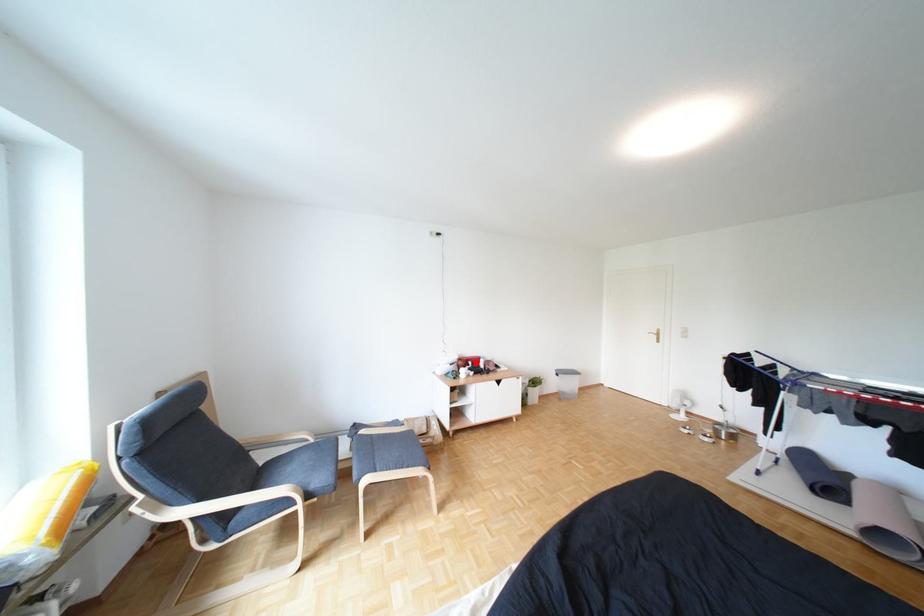
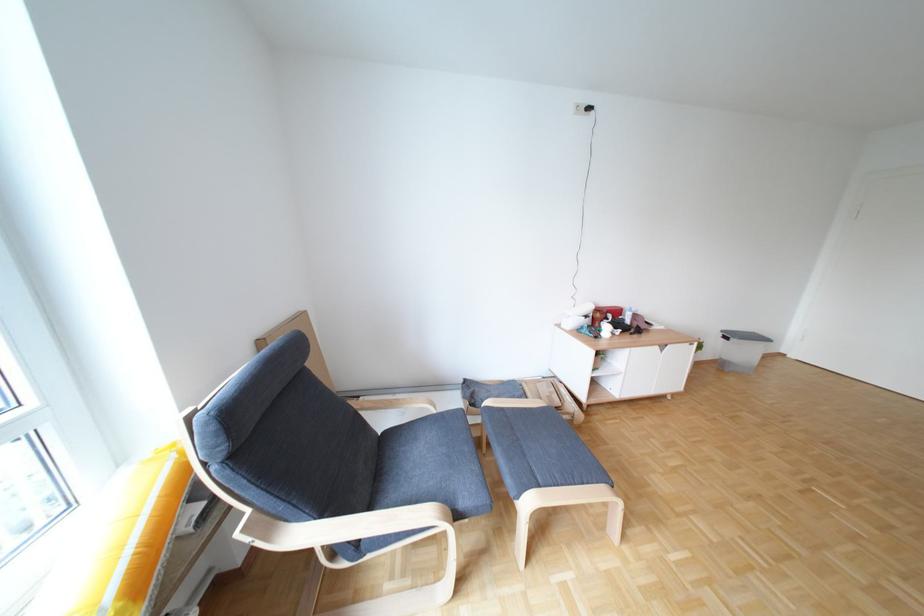
Question: I am providing you with two images of the same scene from different viewpoints. A red point is shown in image1. For the corresponding object point in image2, is it positioned nearer or farther from the camera?

Choices:
 (A) Nearer
 (B) Farther

Answer: (A)